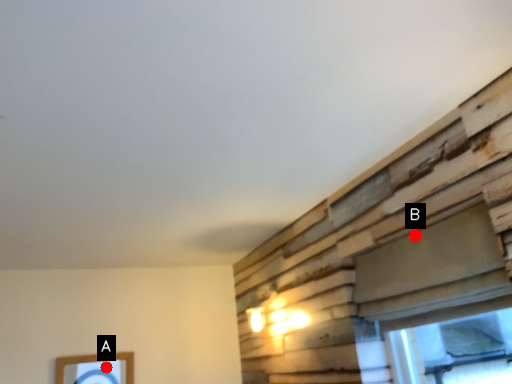
Question: Two points are circled on the image, labeled by A and B beside each circle. Which of the following is the farthest from the observer?

Choices:
 (A) A is further
 (B) B is further

Answer: (A)